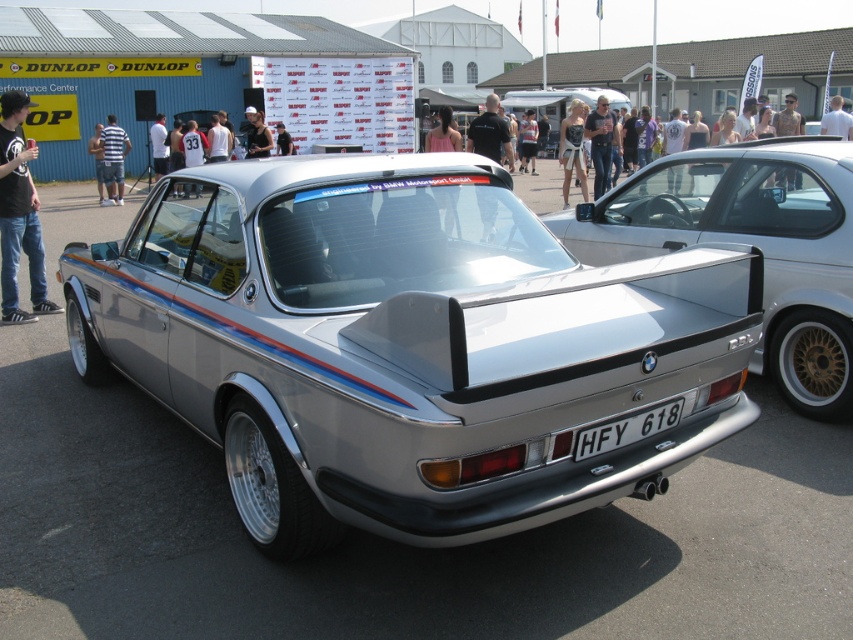
Is denim skirt at center shorter than white cotton t-shirt at center?

No, denim skirt at center is not shorter than white cotton t-shirt at center.

Which is behind, point (583, 109) or point (164, 163)?

The point (164, 163) is behind.

Is point (578, 129) closer to camera compared to point (155, 176)?

Yes, it is in front of point (155, 176).

Locate an element on the screen. This screenshot has width=853, height=640. denim skirt at center is located at coordinates (572, 148).

From the picture: Which is more to the left, satin silver car at center or black cotton shirt at left?

From the viewer's perspective, black cotton shirt at left appears more on the left side.

Is satin silver car at center thinner than black cotton shirt at left?

No, satin silver car at center is not thinner than black cotton shirt at left.

Between point (459, 472) and point (7, 243), which one is positioned behind?

Point (7, 243)

Locate an element on the screen. Image resolution: width=853 pixels, height=640 pixels. satin silver car at center is located at coordinates (405, 346).

Is striped fabric shorts at center below striped shirt at center?

Indeed, striped fabric shorts at center is positioned under striped shirt at center.

Is point (103, 150) closer to camera compared to point (102, 128)?

Yes, point (103, 150) is closer to viewer.

Between point (115, 198) and point (91, 138), which one is positioned behind?

The point (91, 138) is more distant.

You are a GUI agent. You are given a task and a screenshot of the screen. Output one action in this format:
    pyautogui.click(x=<x>, y=<y>)
    Task: Click on the striped fabric shorts at center
    This screenshot has height=640, width=853.
    Given the screenshot: What is the action you would take?
    pyautogui.click(x=113, y=160)